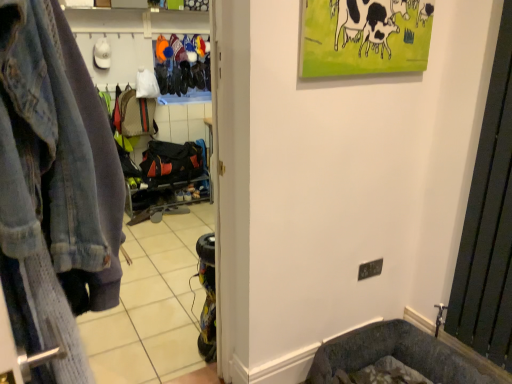
Question: From a real-world perspective, relative to faded denim jacket at left, is black metal radiator at right vertically above or below?

Choices:
 (A) above
 (B) below

Answer: (B)

Question: In terms of height, does black metal radiator at right look taller or shorter compared to faded denim jacket at left?

Choices:
 (A) short
 (B) tall

Answer: (A)

Question: Which is nearer to the faded denim jacket at left?

Choices:
 (A) black metal radiator at right
 (B) faded denim jacket at left

Answer: (B)

Question: Which of these objects is positioned farthest from the faded denim jacket at left?

Choices:
 (A) faded denim jacket at left
 (B) black metal radiator at right

Answer: (B)